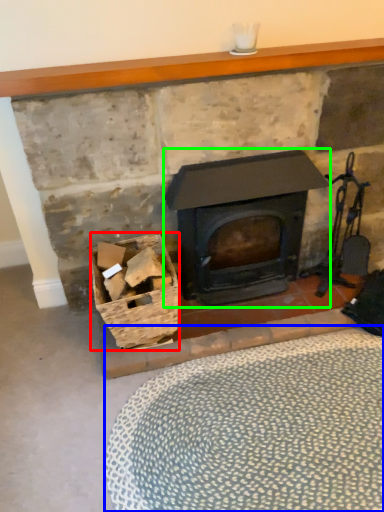
Question: Considering the real-world distances, which object is farthest from basket (highlighted by a red box)? plain (highlighted by a blue box) or wood burning stove (highlighted by a green box)?

Choices:
 (A) plain
 (B) wood burning stove

Answer: (A)